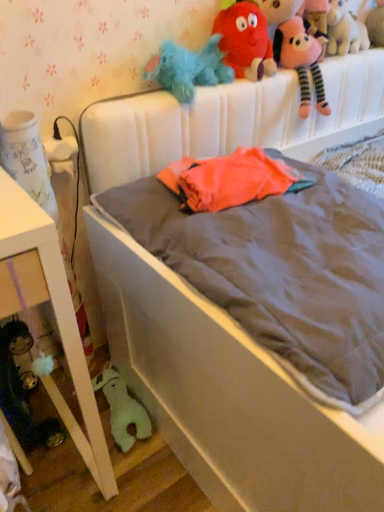
What are the coordinates of `pink plush unicorn at upper right, marked as the 4th toy in a bottom-to-top arrangement` in the screenshot? It's located at (345, 30).

How much space does green plush toy at lower left, positioned as the first toy in bottom-to-top order, occupy horizontally?

green plush toy at lower left, positioned as the first toy in bottom-to-top order, is 12.60 inches wide.

Locate an element on the screen. This screenshot has height=512, width=384. white glossy nightstand at lower left is located at coordinates (54, 312).

What do you see at coordinates (54, 312) in the screenshot? This screenshot has height=512, width=384. I see `white glossy nightstand at lower left` at bounding box center [54, 312].

Measure the distance between point (370, 15) and camera.

They are 1.52 meters apart.

The width and height of the screenshot is (384, 512). Describe the element at coordinates (227, 394) in the screenshot. I see `white fabric bed at center` at that location.

Where is `fluffy plush toys at upper right`? The height and width of the screenshot is (512, 384). fluffy plush toys at upper right is located at coordinates (300, 23).

Consider the image. Between pink plush unicorn at upper right, marked as the 4th toy in a bottom-to-top arrangement, and white fabric bed at center, which one has smaller width?

pink plush unicorn at upper right, marked as the 4th toy in a bottom-to-top arrangement, is thinner.

Identify the location of the 4th toy located above the white fabric bed at center (from a real-world perspective). (345, 30).

Which is correct: pink plush unicorn at upper right, acting as the second toy starting from the top, is inside white fabric bed at center, or outside of it?

pink plush unicorn at upper right, acting as the second toy starting from the top, lies outside white fabric bed at center.

From the image's perspective, who appears lower, pink plush unicorn at upper right, the fourth toy in the left-to-right sequence, or white fabric bed at center?

white fabric bed at center is shown below in the image.

From the picture: Is green plush toy at lower left, the fifth toy from the top, outside of pink plush unicorn at upper right, marked as the 4th toy in a bottom-to-top arrangement?

That's correct, green plush toy at lower left, the fifth toy from the top, is outside of pink plush unicorn at upper right, marked as the 4th toy in a bottom-to-top arrangement.

Can you confirm if green plush toy at lower left, positioned as the first toy in left-to-right order, is smaller than pink plush unicorn at upper right, marked as the 4th toy in a bottom-to-top arrangement?

Indeed, green plush toy at lower left, positioned as the first toy in left-to-right order, has a smaller size compared to pink plush unicorn at upper right, marked as the 4th toy in a bottom-to-top arrangement.

Is the position of green plush toy at lower left, positioned as the first toy in left-to-right order, more distant than that of pink plush unicorn at upper right, the fourth toy in the left-to-right sequence?

No, it is in front of pink plush unicorn at upper right, the fourth toy in the left-to-right sequence.

From a real-world perspective, which is physically above, white glossy nightstand at lower left or fuzzy beige stuffed animal at upper right, marked as the fifth toy in a bottom-to-top arrangement?

In real-world perspective, fuzzy beige stuffed animal at upper right, marked as the fifth toy in a bottom-to-top arrangement, is above.

Considering the positions of points (97, 475) and (372, 17), is point (97, 475) closer to camera compared to point (372, 17)?

Yes.

Looking at this image, considering the relative sizes of white glossy nightstand at lower left and fuzzy beige stuffed animal at upper right, which is the 1th toy from right to left, in the image provided, is white glossy nightstand at lower left bigger than fuzzy beige stuffed animal at upper right, which is the 1th toy from right to left,?

Yes.

Could you measure the distance between white glossy nightstand at lower left and fuzzy beige stuffed animal at upper right, arranged as the 1th toy when viewed from the top?

white glossy nightstand at lower left is 4.89 feet from fuzzy beige stuffed animal at upper right, arranged as the 1th toy when viewed from the top.

Which is more to the right, white glossy nightstand at lower left or fuzzy blue stuffed animal at upper center, the fourth toy from the right?

From the viewer's perspective, fuzzy blue stuffed animal at upper center, the fourth toy from the right, appears more on the right side.

From a real-world perspective, which object stands above the other?

fuzzy blue stuffed animal at upper center, which is counted as the fourth toy, starting from the top.

Consider the image. Which object is closer to the camera, white glossy nightstand at lower left or fuzzy blue stuffed animal at upper center, placed as the 2th toy when sorted from bottom to top?

white glossy nightstand at lower left is closer to the camera.

Does fuzzy blue stuffed animal at upper center, which is the 2th toy in left-to-right order, appear on the left side of fluffy plush toys at upper right?

Yes, fuzzy blue stuffed animal at upper center, which is the 2th toy in left-to-right order, is to the left of fluffy plush toys at upper right.

Which of these two, fuzzy blue stuffed animal at upper center, the fourth toy from the right, or fluffy plush toys at upper right, is smaller?

With smaller size is fuzzy blue stuffed animal at upper center, the fourth toy from the right.

Who is taller, fuzzy blue stuffed animal at upper center, which is the 2th toy in left-to-right order, or fluffy plush toys at upper right?

With more height is fluffy plush toys at upper right.

How different are the orientations of fuzzy blue stuffed animal at upper center, placed as the 2th toy when sorted from bottom to top, and fluffy plush toys at upper right in degrees?

They differ by 0.00183 degrees in their facing directions.

Which of these two, fluffy plush toys at upper right or white fabric bed at center, is smaller?

With smaller size is fluffy plush toys at upper right.

Is point (294, 3) closer or farther from the camera than point (179, 311)?

Point (294, 3) is farther from the camera than point (179, 311).

From the picture: Considering the relative sizes of fluffy plush toys at upper right and white fabric bed at center in the image provided, is fluffy plush toys at upper right wider than white fabric bed at center?

In fact, fluffy plush toys at upper right might be narrower than white fabric bed at center.

Is fluffy plush toys at upper right beside white fabric bed at center?

They are not placed beside each other.

From the image's perspective, which object appears higher, green plush toy at lower left, the fifth toy from the top, or fuzzy beige stuffed animal at upper right, acting as the fifth toy starting from the left?

fuzzy beige stuffed animal at upper right, acting as the fifth toy starting from the left, appears higher in the image.

Considering the positions of points (133, 438) and (374, 45), is point (133, 438) closer to camera compared to point (374, 45)?

Yes, point (133, 438) is closer to viewer.

Which of these two, green plush toy at lower left, marked as the 5th toy in a right-to-left arrangement, or fuzzy beige stuffed animal at upper right, which is the 1th toy from right to left, stands taller?

fuzzy beige stuffed animal at upper right, which is the 1th toy from right to left.

Is green plush toy at lower left, the fifth toy from the top, facing away from fuzzy beige stuffed animal at upper right, acting as the fifth toy starting from the left?

That's not correct — green plush toy at lower left, the fifth toy from the top, is not looking away from fuzzy beige stuffed animal at upper right, acting as the fifth toy starting from the left.

You are a GUI agent. You are given a task and a screenshot of the screen. Output one action in this format:
    pyautogui.click(x=<x>, y=<y>)
    Task: Click on the bed on the right of pink plush unicorn at upper right, marked as the 4th toy in a bottom-to-top arrangement
    Image resolution: width=384 pixels, height=512 pixels.
    Given the screenshot: What is the action you would take?
    pyautogui.click(x=227, y=394)

What are the coordinates of `toy that is the 3rd one when counting upward from the green plush toy at lower left, the fifth toy from the top (from the image's perspective)` in the screenshot? It's located at [x=345, y=30].

From the picture: Looking at the image, which one is located closer to fluffy plush toy at upper right, placed as the third toy when sorted from top to bottom, pink plush unicorn at upper right, acting as the second toy starting from the top, or green plush toy at lower left, positioned as the first toy in left-to-right order?

The object closer to fluffy plush toy at upper right, placed as the third toy when sorted from top to bottom, is pink plush unicorn at upper right, acting as the second toy starting from the top.

When comparing their distances from pink plush unicorn at upper right, marked as the 4th toy in a bottom-to-top arrangement, does fluffy plush toy at upper right, the third toy from the left, or white glossy nightstand at lower left seem closer?

fluffy plush toy at upper right, the third toy from the left, lies closer to pink plush unicorn at upper right, marked as the 4th toy in a bottom-to-top arrangement, than the other object.

Estimate the real-world distances between objects in this image. Which object is further from fluffy plush toys at upper right, white fabric bed at center or fuzzy beige stuffed animal at upper right, arranged as the 1th toy when viewed from the top?

fuzzy beige stuffed animal at upper right, arranged as the 1th toy when viewed from the top.

Based on their spatial positions, is fluffy plush toys at upper right or green plush toy at lower left, positioned as the first toy in bottom-to-top order, further from pink plush unicorn at upper right, the fourth toy in the left-to-right sequence?

green plush toy at lower left, positioned as the first toy in bottom-to-top order, lies further to pink plush unicorn at upper right, the fourth toy in the left-to-right sequence, than the other object.

Considering their positions, is green plush toy at lower left, the fifth toy from the top, positioned closer to white fabric bed at center than fluffy plush toys at upper right?

Based on the image, fluffy plush toys at upper right appears to be nearer to white fabric bed at center.

Considering their positions, is green plush toy at lower left, marked as the 5th toy in a right-to-left arrangement, positioned closer to fuzzy beige stuffed animal at upper right, marked as the fifth toy in a bottom-to-top arrangement, than pink plush unicorn at upper right, the fourth toy in the left-to-right sequence?

pink plush unicorn at upper right, the fourth toy in the left-to-right sequence, is closer to fuzzy beige stuffed animal at upper right, marked as the fifth toy in a bottom-to-top arrangement.

When comparing their distances from fluffy plush toys at upper right, does green plush toy at lower left, positioned as the first toy in bottom-to-top order, or pink plush unicorn at upper right, which appears as the second toy when viewed from the right, seem further?

green plush toy at lower left, positioned as the first toy in bottom-to-top order, is further to fluffy plush toys at upper right.

Which object lies further to the anchor point pink plush unicorn at upper right, which appears as the second toy when viewed from the right, white fabric bed at center or fuzzy blue stuffed animal at upper center, placed as the 2th toy when sorted from bottom to top?

The object further to pink plush unicorn at upper right, which appears as the second toy when viewed from the right, is white fabric bed at center.

Locate an element on the screen. This screenshot has height=512, width=384. bed between pink plush unicorn at upper right, the fourth toy in the left-to-right sequence, and green plush toy at lower left, marked as the 5th toy in a right-to-left arrangement, in the vertical direction is located at coordinates (227, 394).

Where is `nightstand between fluffy plush toys at upper right and green plush toy at lower left, marked as the 5th toy in a right-to-left arrangement, from top to bottom`? nightstand between fluffy plush toys at upper right and green plush toy at lower left, marked as the 5th toy in a right-to-left arrangement, from top to bottom is located at coordinates (54, 312).

This screenshot has width=384, height=512. Find the location of `stuff between fluffy plush toy at upper right, the third toy from the right, and fuzzy beige stuffed animal at upper right, arranged as the 1th toy when viewed from the top, from left to right`. stuff between fluffy plush toy at upper right, the third toy from the right, and fuzzy beige stuffed animal at upper right, arranged as the 1th toy when viewed from the top, from left to right is located at coordinates (300, 23).

This screenshot has width=384, height=512. Find the location of `stuff that lies between fuzzy beige stuffed animal at upper right, arranged as the 1th toy when viewed from the top, and green plush toy at lower left, marked as the 5th toy in a right-to-left arrangement, from top to bottom`. stuff that lies between fuzzy beige stuffed animal at upper right, arranged as the 1th toy when viewed from the top, and green plush toy at lower left, marked as the 5th toy in a right-to-left arrangement, from top to bottom is located at coordinates (300, 23).